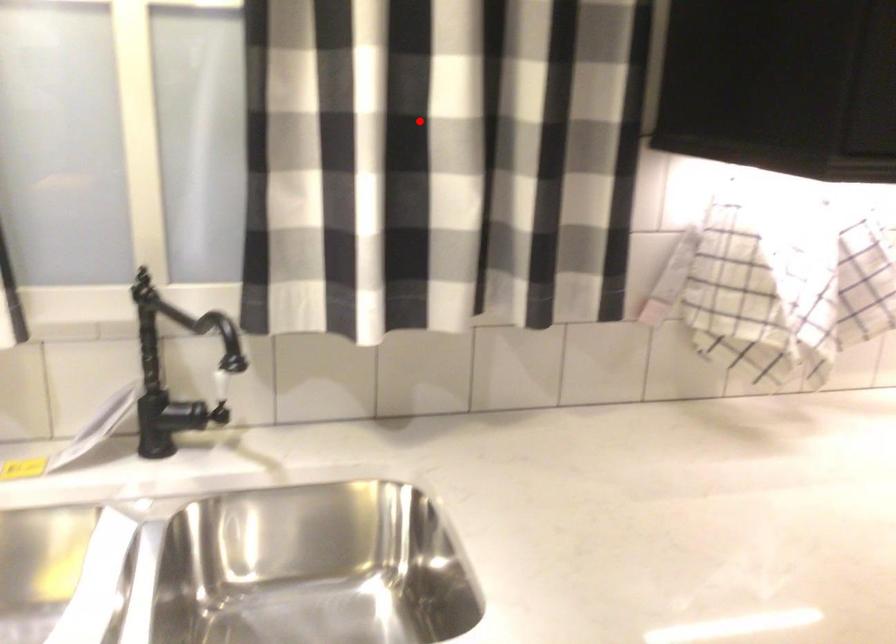
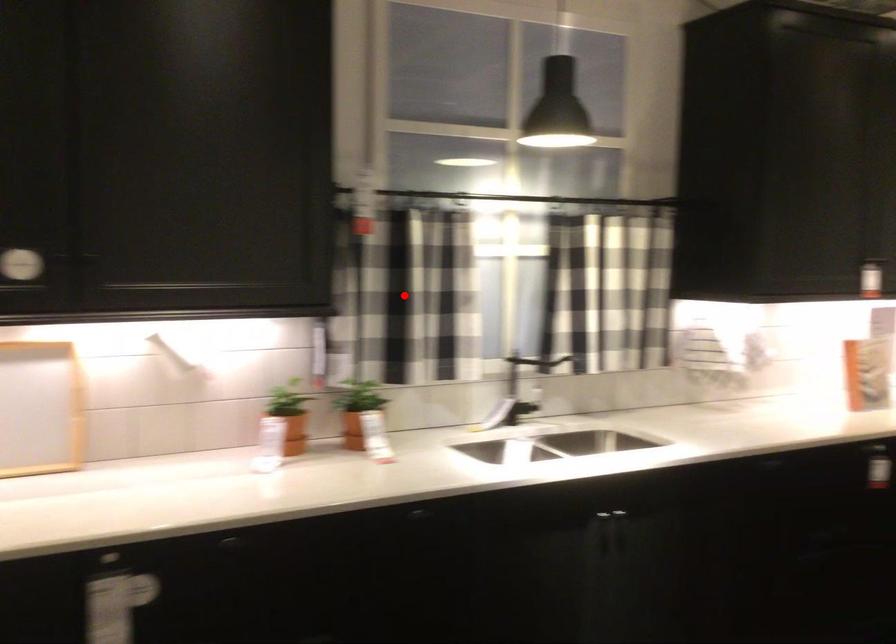
I am providing you with two images of the same scene from different viewpoints. A red point is marked on the first image and another point is marked on the second image. Does the point marked in image1 correspond to the same location as the one in image2?

No